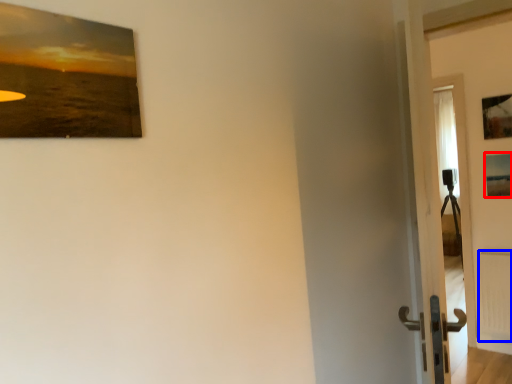
Question: Which object is further to the camera taking this photo, picture frame (highlighted by a red box) or radiator (highlighted by a blue box)?

Choices:
 (A) picture frame
 (B) radiator

Answer: (B)